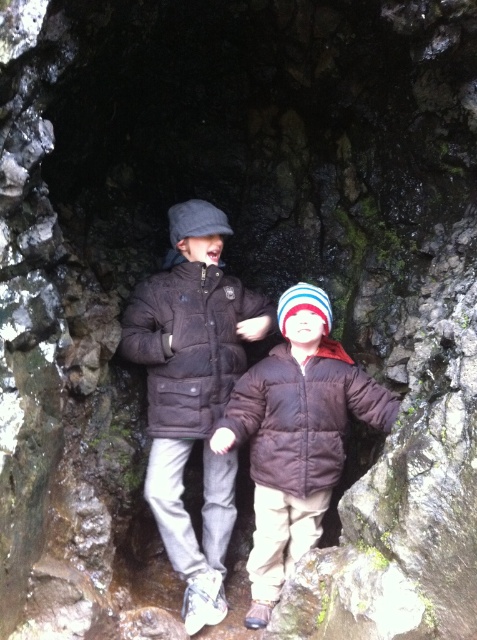
Question: Is matte black jacket at center thinner than brown puffy coat at center?

Choices:
 (A) no
 (B) yes

Answer: (B)

Question: Does matte black jacket at center lie in front of brown puffy coat at center?

Choices:
 (A) no
 (B) yes

Answer: (B)

Question: Which point appears closest to the camera in this image?

Choices:
 (A) (187, 273)
 (B) (252, 618)

Answer: (B)

Question: Is matte black jacket at center bigger than brown puffy coat at center?

Choices:
 (A) yes
 (B) no

Answer: (A)